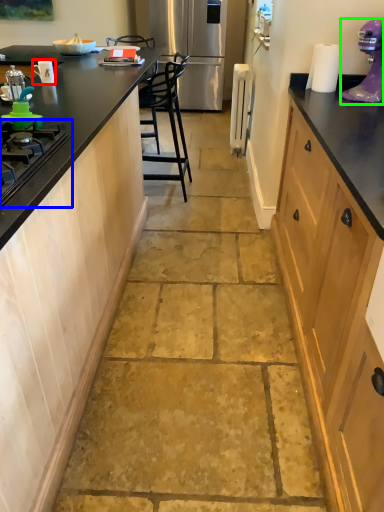
Question: Estimate the real-world distances between objects in this image. Which object is closer to appliance (highlighted by a red box), gas stove (highlighted by a blue box) or home appliance (highlighted by a green box)?

Choices:
 (A) gas stove
 (B) home appliance

Answer: (A)